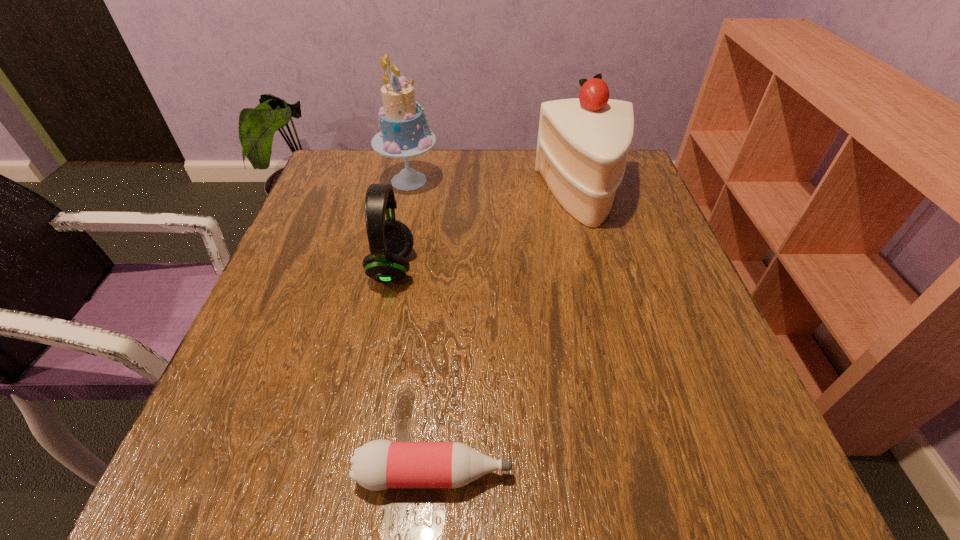
What are the coordinates of `vacant space located 0.360m on the ear cups of the headset` in the screenshot? It's located at (591, 268).

I want to click on vacant space situated 0.080m with the cap open on the shortest object, so click(569, 474).

Locate an element on the screen. object present at the near edge is located at coordinates (378, 465).

Where is `object located at the left edge`? The width and height of the screenshot is (960, 540). object located at the left edge is located at coordinates (404, 134).

The height and width of the screenshot is (540, 960). I want to click on object positioned at the right edge, so click(582, 145).

Identify the location of object located at the far left corner. The height and width of the screenshot is (540, 960). (404, 134).

Identify the location of object located at the far right corner. (582, 145).

The width and height of the screenshot is (960, 540). In the image, there is a desktop. Find the location of `free space at the far edge`. free space at the far edge is located at coordinates click(540, 190).

Where is `free space at the near edge of the desktop`? free space at the near edge of the desktop is located at coordinates (640, 499).

In the image, there is a desktop. At what (x,y) coordinates should I click in order to perform the action: click on vacant space at the left edge. Please return your answer as a coordinate pair (x, y). Looking at the image, I should click on (283, 265).